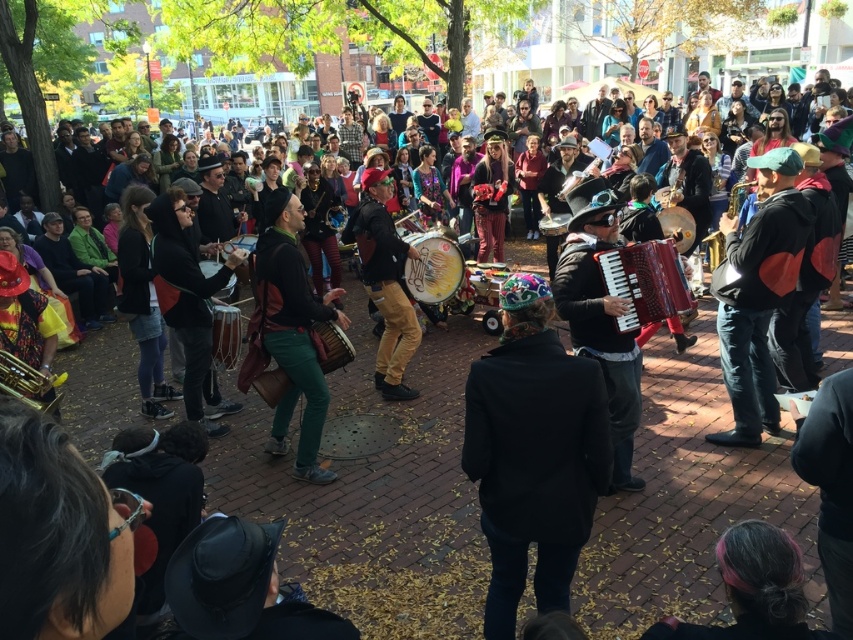
Question: Among these points, which one is farthest from the camera?

Choices:
 (A) (634, 388)
 (B) (683, 276)
 (C) (264, 400)

Answer: (C)

Question: Considering the real-world distances, which object is farthest from the brown leather drum at center?

Choices:
 (A) shiny black accordion at center
 (B) brass/yellowish metal trumpet at lower left
 (C) red matte accordion at center

Answer: (C)

Question: Is shiny black accordion at center below brass/yellowish metal trumpet at lower left?

Choices:
 (A) no
 (B) yes

Answer: (A)

Question: Which point is farther to the camera?

Choices:
 (A) brass/yellowish metal trumpet at lower left
 (B) wooden drum at center
 (C) brown leather drum at center

Answer: (B)

Question: Observing the image, what is the correct spatial positioning of matte drum at center in reference to brass/yellowish metal trumpet at lower left?

Choices:
 (A) below
 (B) above

Answer: (B)

Question: Does matte drum at center appear over matte brown drum at center?

Choices:
 (A) yes
 (B) no

Answer: (B)